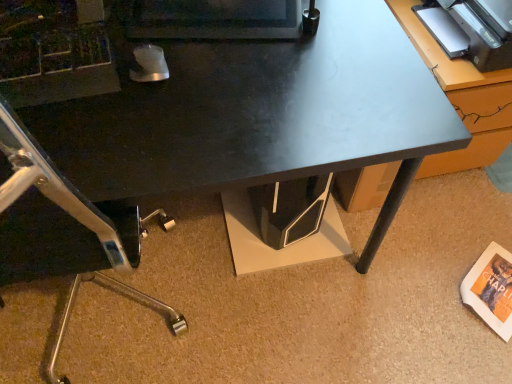
You are a GUI agent. You are given a task and a screenshot of the screen. Output one action in this format:
    pyautogui.click(x=<x>, y=<y>)
    Task: Click on the black glossy desk at center
    The height and width of the screenshot is (384, 512).
    Given the screenshot: What is the action you would take?
    pyautogui.click(x=259, y=115)

The width and height of the screenshot is (512, 384). What are the coordinates of `metallic gray table at upper right` in the screenshot? It's located at (448, 60).

What do you see at coordinates (211, 19) in the screenshot? The width and height of the screenshot is (512, 384). I see `matte black monitor at upper center` at bounding box center [211, 19].

Find the location of a particular element. This screenshot has width=512, height=384. black glossy desk at center is located at coordinates (259, 115).

Is black glossy desk at center taller than matte black monitor at upper center?

Yes.

Is point (18, 124) farther from viewer compared to point (167, 9)?

That is False.

Is the surface of black glossy desk at center in direct contact with matte black monitor at upper center?

black glossy desk at center and matte black monitor at upper center are not in contact.

Looking at the image, does matte black monitor at upper center seem bigger or smaller compared to metallic gray table at upper right?

In the image, matte black monitor at upper center appears to be smaller than metallic gray table at upper right.

Can you confirm if matte black monitor at upper center is taller than metallic gray table at upper right?

Incorrect, the height of matte black monitor at upper center is not larger of that of metallic gray table at upper right.

From the image's perspective, is matte black monitor at upper center on metallic gray table at upper right?

Yes, from the image's perspective, matte black monitor at upper center is on top of metallic gray table at upper right.

What's the angular difference between matte black monitor at upper center and metallic gray table at upper right's facing directions?

14.9 degrees separate the facing orientations of matte black monitor at upper center and metallic gray table at upper right.

The width and height of the screenshot is (512, 384). Find the location of `table directly beneath the black glossy desk at center (from a real-world perspective)`. table directly beneath the black glossy desk at center (from a real-world perspective) is located at coordinates (448, 60).

Is metallic gray table at upper right positioned far away from black glossy desk at center?

No, there isn't a large distance between metallic gray table at upper right and black glossy desk at center.

Can you confirm if metallic gray table at upper right is smaller than black glossy desk at center?

Yes.

How distant is metallic gray table at upper right from black glossy desk at center?

23.55 inches.

Can you tell me how much metallic gray table at upper right and matte black monitor at upper center differ in facing direction?

metallic gray table at upper right and matte black monitor at upper center are facing 14.9 degrees away from each other.

Based on the photo, which is correct: metallic gray table at upper right is inside matte black monitor at upper center, or outside of it?

metallic gray table at upper right cannot be found inside matte black monitor at upper center.

Image resolution: width=512 pixels, height=384 pixels. Identify the location of table below the matte black monitor at upper center (from the image's perspective). point(448,60).

How much distance is there between metallic gray table at upper right and matte black monitor at upper center?

They are 25.62 inches apart.

From a real-world perspective, which is physically below, matte black monitor at upper center or black glossy desk at center?

black glossy desk at center is physically lower.

Is matte black monitor at upper center in contact with black glossy desk at center?

No, matte black monitor at upper center is not touching black glossy desk at center.

In the scene shown: Is matte black monitor at upper center bigger than black glossy desk at center?

No.

Could you tell me if matte black monitor at upper center is turned towards black glossy desk at center?

No, matte black monitor at upper center is not aimed at black glossy desk at center.

Could you tell me if black glossy desk at center is facing metallic gray table at upper right?

No, black glossy desk at center is not aimed at metallic gray table at upper right.

Considering the positions of objects black glossy desk at center and metallic gray table at upper right in the image provided, who is more to the left, black glossy desk at center or metallic gray table at upper right?

black glossy desk at center is more to the left.

Would you consider black glossy desk at center to be distant from metallic gray table at upper right?

Actually, black glossy desk at center and metallic gray table at upper right are a little close together.

Is black glossy desk at center thinner than metallic gray table at upper right?

No, black glossy desk at center is not thinner than metallic gray table at upper right.

You are a GUI agent. You are given a task and a screenshot of the screen. Output one action in this format:
    pyautogui.click(x=<x>, y=<y>)
    Task: Click on the desk in front of the matte black monitor at upper center
    The height and width of the screenshot is (384, 512).
    Given the screenshot: What is the action you would take?
    pyautogui.click(x=259, y=115)

Find the location of a particular element. computer monitor above the metallic gray table at upper right (from a real-world perspective) is located at coordinates 211,19.

Based on their spatial positions, is metallic gray table at upper right or matte black monitor at upper center closer to black glossy desk at center?

Among the two, matte black monitor at upper center is located nearer to black glossy desk at center.

From the image, which object appears to be nearer to matte black monitor at upper center, metallic gray table at upper right or black glossy desk at center?

black glossy desk at center is positioned closer to the anchor matte black monitor at upper center.

Estimate the real-world distances between objects in this image. Which object is closer to metallic gray table at upper right, matte black monitor at upper center or black glossy desk at center?

black glossy desk at center lies closer to metallic gray table at upper right than the other object.

Estimate the real-world distances between objects in this image. Which object is further from metallic gray table at upper right, black glossy desk at center or matte black monitor at upper center?

Based on the image, matte black monitor at upper center appears to be further to metallic gray table at upper right.

Looking at the image, which one is located further to matte black monitor at upper center, black glossy desk at center or metallic gray table at upper right?

The object further to matte black monitor at upper center is metallic gray table at upper right.

From the image, which object appears to be nearer to black glossy desk at center, matte black monitor at upper center or metallic gray table at upper right?

Among the two, matte black monitor at upper center is located nearer to black glossy desk at center.

Locate an element on the screen. This screenshot has width=512, height=384. computer monitor situated between black glossy desk at center and metallic gray table at upper right from left to right is located at coordinates (211, 19).